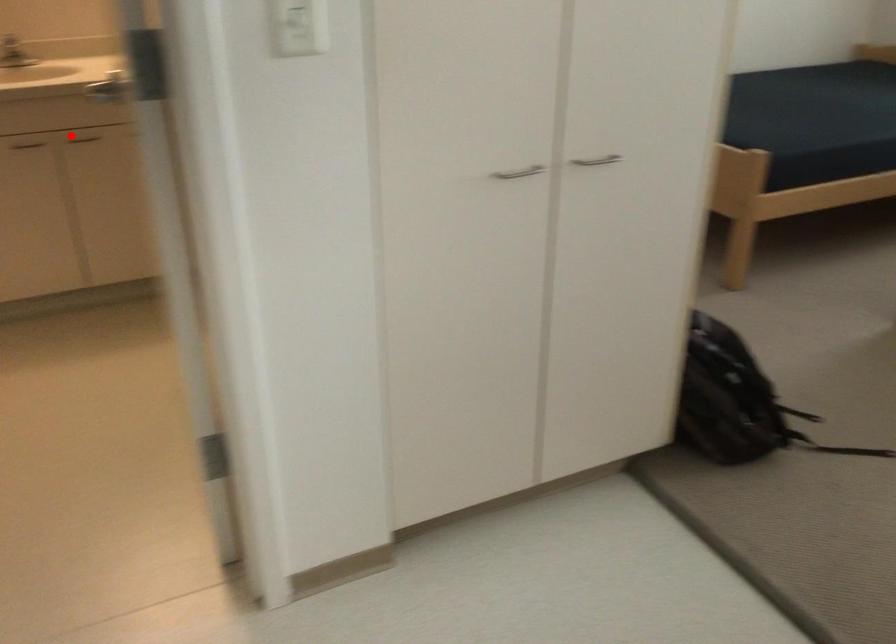
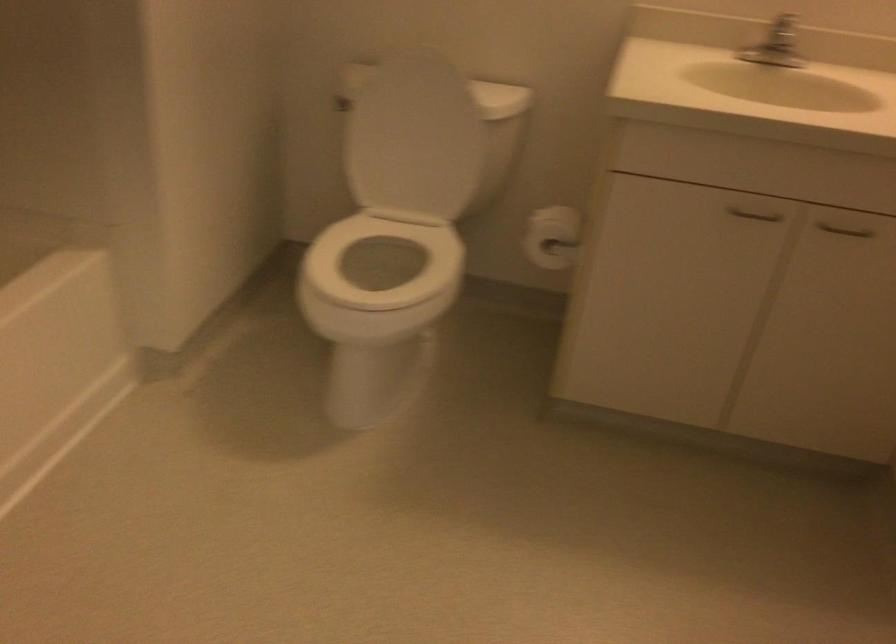
Locate, in the second image, the point that corresponds to the highlighted location in the first image.

(845, 230)